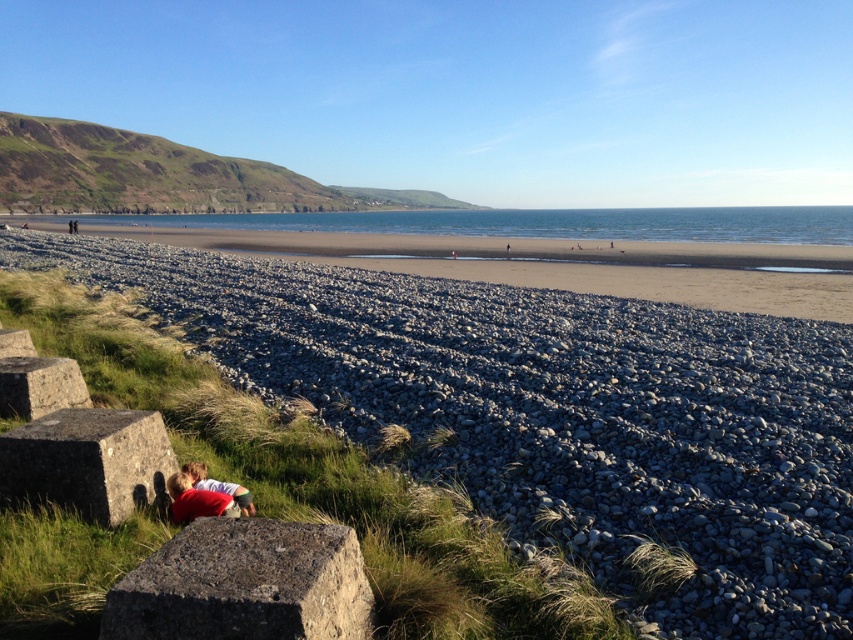
Question: Which object appears closest to the camera in this image?

Choices:
 (A) gray rough stone at lower left
 (B) red cotton shirt at lower left
 (C) red fabric person at lower left

Answer: (B)

Question: Does smooth pebbles at center appear under gray rough stone at lower left?

Choices:
 (A) yes
 (B) no

Answer: (B)

Question: Which of the following is the closest to the observer?

Choices:
 (A) red cotton shirt at lower left
 (B) smooth pebbles at center
 (C) granite rock at lower left
 (D) smooth gray rock at lower left

Answer: (C)

Question: Is smooth pebbles at center wider than gray rough stone at lower left?

Choices:
 (A) yes
 (B) no

Answer: (A)

Question: Among these points, which one is nearest to the camera?

Choices:
 (A) (537, 305)
 (B) (494, 240)

Answer: (A)

Question: Is gray rough stone at lower left closer to camera compared to smooth gray rock at lower left?

Choices:
 (A) no
 (B) yes

Answer: (B)